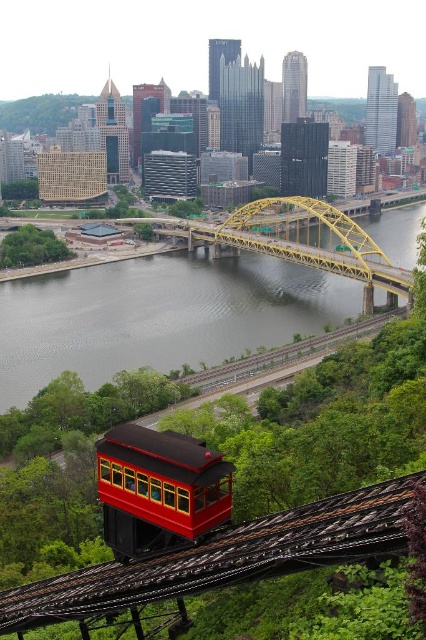
Question: Is the position of gray concrete water at center more distant than that of yellow steel bridge at center?

Choices:
 (A) yes
 (B) no

Answer: (B)

Question: Among these points, which one is nearest to the camera?

Choices:
 (A) (264, 225)
 (B) (123, 493)
 (C) (212, 323)

Answer: (B)

Question: Does gray concrete water at center appear on the left side of shiny red trolley car at center?

Choices:
 (A) yes
 (B) no

Answer: (B)

Question: Can you confirm if shiny red trolley car at center is positioned above yellow steel bridge at center?

Choices:
 (A) yes
 (B) no

Answer: (B)

Question: Which object appears farthest from the camera in this image?

Choices:
 (A) yellow steel bridge at center
 (B) gray concrete water at center

Answer: (A)

Question: Which of the following is the closest to the observer?

Choices:
 (A) shiny red trolley car at center
 (B) yellow steel bridge at center

Answer: (A)